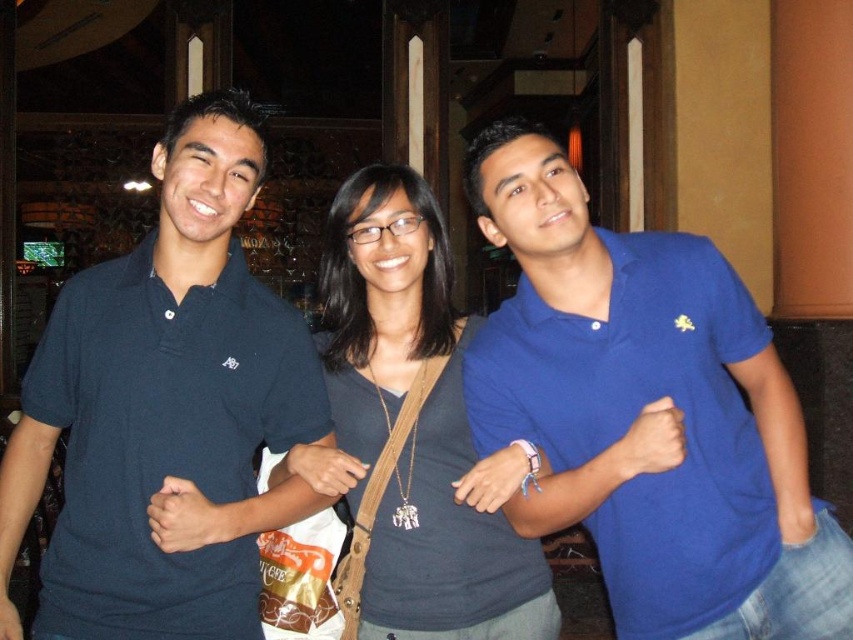
Is dark blue polo shirt at left to the right of matte gray shirt at center from the viewer's perspective?

No, dark blue polo shirt at left is not to the right of matte gray shirt at center.

Can you confirm if dark blue polo shirt at left is positioned above matte gray shirt at center?

→ No.

Identify the location of dark blue polo shirt at left. (165, 410).

What do you see at coordinates (648, 413) in the screenshot? The width and height of the screenshot is (853, 640). I see `blue cotton polo shirt at center` at bounding box center [648, 413].

Identify the location of blue cotton polo shirt at center. This screenshot has height=640, width=853. (648, 413).

Between point (483, 353) and point (247, 179), which one is positioned in front?

Point (247, 179) is more forward.

Which of these two, blue cotton polo shirt at center or dark blue polo shirt at left, stands shorter?

Standing shorter between the two is blue cotton polo shirt at center.

Is point (784, 627) positioned in front of point (45, 392)?

Yes, it is in front of point (45, 392).

Find the location of `blue cotton polo shirt at center`. blue cotton polo shirt at center is located at coordinates (648, 413).